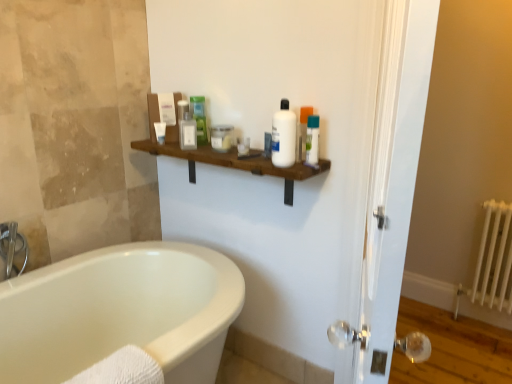
Question: Is brushed metal faucet at left further to camera compared to white metal radiator at right?

Choices:
 (A) yes
 (B) no

Answer: (B)

Question: From the image's perspective, does brushed metal faucet at left appear higher than white metal radiator at right?

Choices:
 (A) no
 (B) yes

Answer: (B)

Question: Does brushed metal faucet at left come in front of white metal radiator at right?

Choices:
 (A) yes
 (B) no

Answer: (A)

Question: Does brushed metal faucet at left have a lesser width compared to white metal radiator at right?

Choices:
 (A) yes
 (B) no

Answer: (A)

Question: From a real-world perspective, is brushed metal faucet at left on top of white metal radiator at right?

Choices:
 (A) yes
 (B) no

Answer: (A)

Question: From their relative heights in the image, would you say translucent plastic bottle at center, the 7th toiletry positioned from the left, is taller or shorter than white plastic bottle at center?

Choices:
 (A) short
 (B) tall

Answer: (A)

Question: From a real-world perspective, is translucent plastic bottle at center, the 7th toiletry positioned from the left, above or below white plastic bottle at center?

Choices:
 (A) above
 (B) below

Answer: (B)

Question: In the image, is translucent plastic bottle at center, the 7th toiletry positioned from the left, positioned in front of or behind white plastic bottle at center?

Choices:
 (A) front
 (B) behind

Answer: (B)

Question: From the image's perspective, relative to white plastic bottle at center, is translucent plastic bottle at center, the 7th toiletry positioned from the left, above or below?

Choices:
 (A) above
 (B) below

Answer: (B)

Question: From the image's perspective, is matte plastic container at upper center, the second toiletry viewed from the left, positioned above or below brown wooden shelf at upper center?

Choices:
 (A) below
 (B) above

Answer: (B)

Question: Based on their positions, is matte plastic container at upper center, the second toiletry viewed from the left, located to the left or right of brown wooden shelf at upper center?

Choices:
 (A) left
 (B) right

Answer: (A)

Question: Is matte plastic container at upper center, the second toiletry viewed from the left, inside or outside of brown wooden shelf at upper center?

Choices:
 (A) outside
 (B) inside

Answer: (A)

Question: Is point (185, 102) positioned closer to the camera than point (168, 145)?

Choices:
 (A) closer
 (B) farther

Answer: (B)

Question: Is white glossy screen door at right bigger or smaller than brushed metal faucet at left?

Choices:
 (A) small
 (B) big

Answer: (B)

Question: From a real-world perspective, is white glossy screen door at right positioned above or below brushed metal faucet at left?

Choices:
 (A) below
 (B) above

Answer: (B)